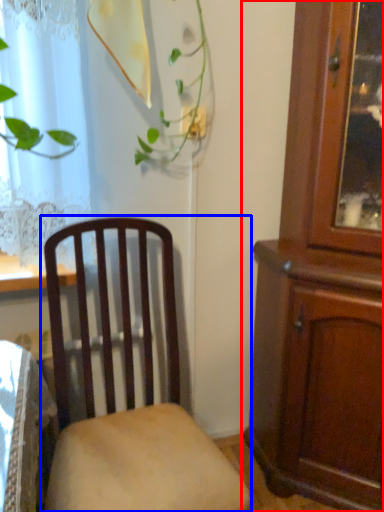
Question: Which point is further to the camera, cabinetry (highlighted by a red box) or chair (highlighted by a blue box)?

Choices:
 (A) cabinetry
 (B) chair

Answer: (A)